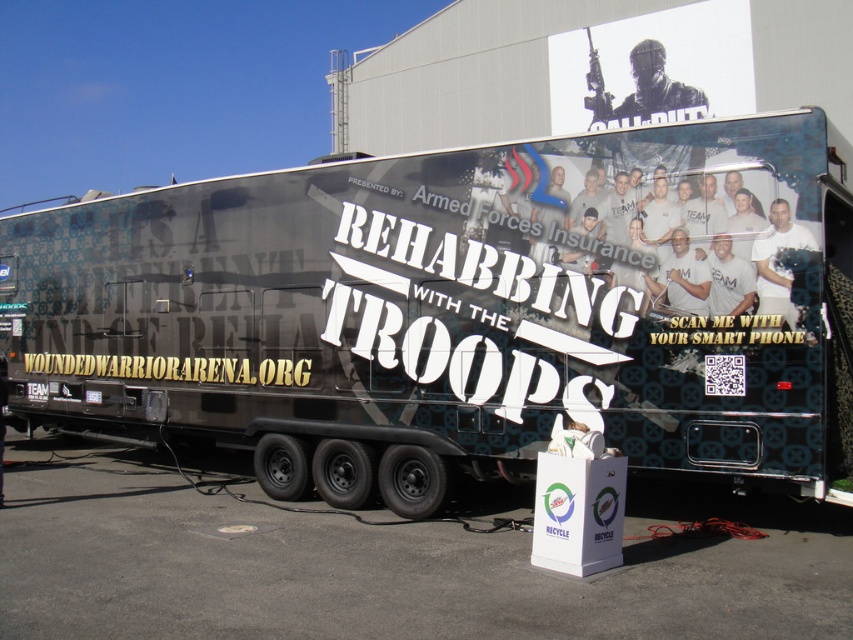
Question: Is matte black trailer truck at center smaller than white cardboard at lower center?

Choices:
 (A) yes
 (B) no

Answer: (B)

Question: Which of the following is the farthest from the observer?

Choices:
 (A) matte black trailer truck at center
 (B) white cardboard at lower center

Answer: (A)

Question: Considering the relative positions of matte black trailer truck at center and white cardboard at lower center in the image provided, where is matte black trailer truck at center located with respect to white cardboard at lower center?

Choices:
 (A) left
 (B) right

Answer: (B)

Question: Is matte black trailer truck at center positioned at the back of white cardboard at lower center?

Choices:
 (A) yes
 (B) no

Answer: (A)

Question: Which point is closer to the camera taking this photo?

Choices:
 (A) (20, 268)
 (B) (780, 588)

Answer: (B)